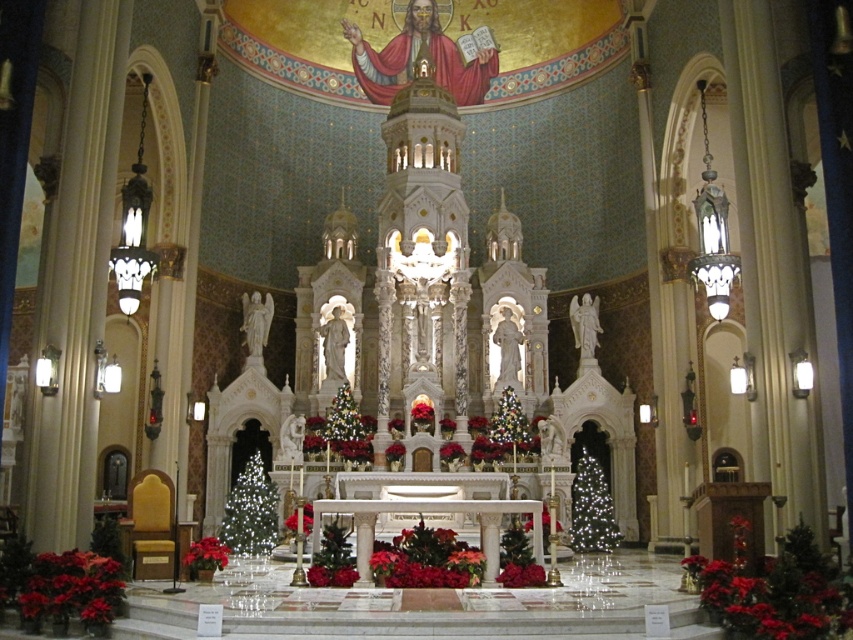
Find the location of `illuminated glass christmas tree at right`. illuminated glass christmas tree at right is located at coordinates (590, 508).

Based on the photo, which of these two, illuminated glass christmas tree at right or shiny metallic tree at center, stands taller?

Result: Standing taller between the two is illuminated glass christmas tree at right.

Who is more distant from viewer, (587, 506) or (503, 445)?

Point (503, 445)

Find the location of a particular element. The image size is (853, 640). illuminated glass christmas tree at right is located at coordinates (590, 508).

Describe the element at coordinates (250, 512) in the screenshot. I see `illuminated glass christmas tree at lower left` at that location.

Who is more forward, [264,540] or [575,532]?

Point [264,540] is more forward.

The width and height of the screenshot is (853, 640). In order to click on illuminated glass christmas tree at lower left in this screenshot , I will do `click(250, 512)`.

Looking at this image, is illuminated glass christmas tree at lower left above shiny metallic tree at center?

No.

Which is more to the right, illuminated glass christmas tree at lower left or shiny metallic tree at center?

shiny metallic tree at center is more to the right.

Is point (260, 529) in front of point (519, 422)?

Yes, it is.

Identify the location of illuminated glass christmas tree at lower left. This screenshot has height=640, width=853. (250, 512).